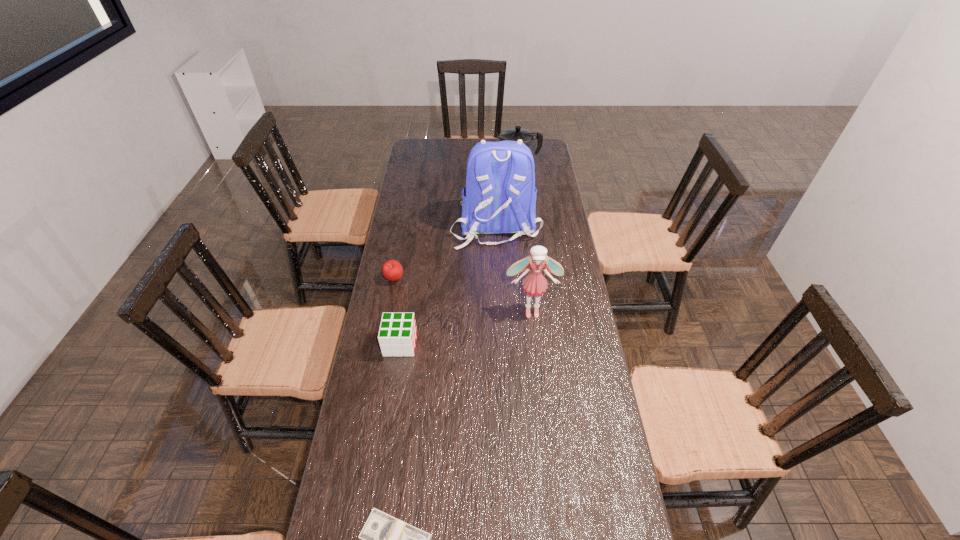
This screenshot has height=540, width=960. In order to click on doll that is positioned at the right edge in this screenshot , I will do `click(535, 284)`.

Identify the location of coffeepot that is at the right edge. The height and width of the screenshot is (540, 960). (515, 134).

The width and height of the screenshot is (960, 540). Find the location of `free location at the left edge`. free location at the left edge is located at coordinates (426, 218).

Identify the location of vacant area at the right edge of the desktop. This screenshot has height=540, width=960. (566, 488).

Where is `vacant space at the far left corner`? This screenshot has height=540, width=960. vacant space at the far left corner is located at coordinates (438, 145).

Where is `empty location between the third tallest object and the cube`? The image size is (960, 540). empty location between the third tallest object and the cube is located at coordinates (459, 257).

Locate an element on the screen. The height and width of the screenshot is (540, 960). free space between the fifth tallest object and the coffeepot is located at coordinates (456, 225).

Where is `vacant area that lies between the coffeepot and the fifth farthest object`? vacant area that lies between the coffeepot and the fifth farthest object is located at coordinates (459, 257).

Point out which object is positioned as the fifth nearest to the fifth farthest object. Please provide its 2D coordinates. Your answer should be formatted as a tuple, i.e. [(x, y)], where the tuple contains the x and y coordinates of a point satisfying the conditions above.

[(515, 134)]

Choose which object is the fifth nearest neighbor to the fifth shortest object. Please provide its 2D coordinates. Your answer should be formatted as a tuple, i.e. [(x, y)], where the tuple contains the x and y coordinates of a point satisfying the conditions above.

[(515, 134)]